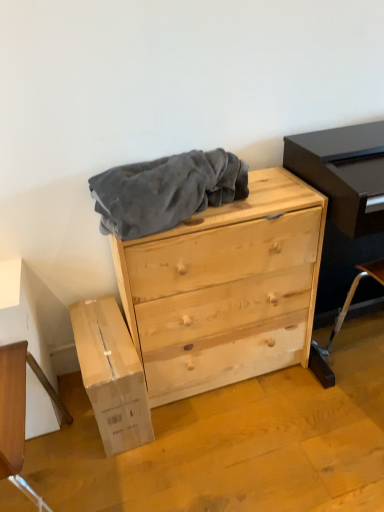
Identify the location of free area below matte black entertainment center at right (from a real-world perspective). Image resolution: width=384 pixels, height=512 pixels. (363, 365).